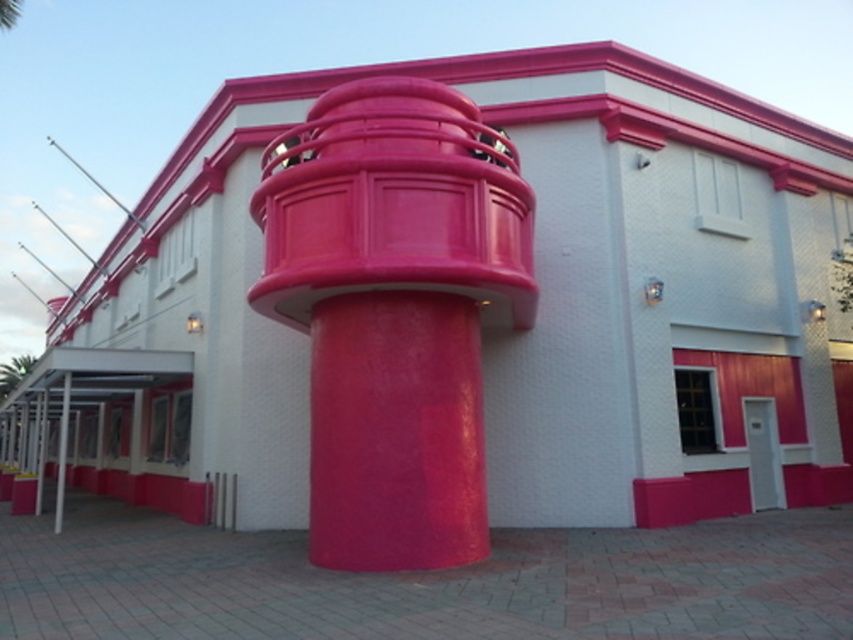
Question: Is glossy plastic column at center positioned before metallic silver pole at left?

Choices:
 (A) yes
 (B) no

Answer: (A)

Question: Where is glossy plastic column at center located in relation to metallic silver pole at left in the image?

Choices:
 (A) left
 (B) right

Answer: (B)

Question: Which point is farther to the camera?

Choices:
 (A) metallic silver pole at left
 (B) glossy plastic column at center

Answer: (A)

Question: Is glossy plastic column at center wider than metallic silver pole at left?

Choices:
 (A) yes
 (B) no

Answer: (B)

Question: Which point is farther from the camera taking this photo?

Choices:
 (A) (57, 484)
 (B) (405, 128)

Answer: (A)